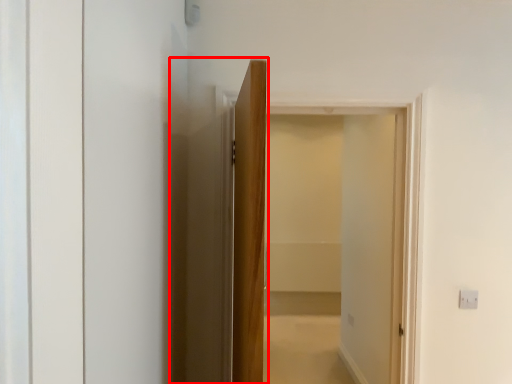
Question: From the image's perspective, where is elevator (annotated by the red box) located in relation to screen door in the image?

Choices:
 (A) above
 (B) below

Answer: (B)